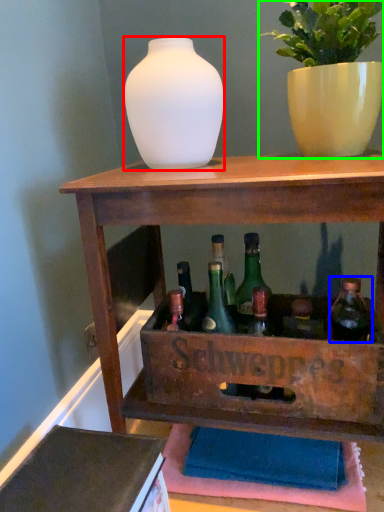
Question: Based on their relative distances, which object is farther from vase (highlighted by a red box)? Choose from bottle (highlighted by a blue box) and houseplant (highlighted by a green box).

Choices:
 (A) bottle
 (B) houseplant

Answer: (A)